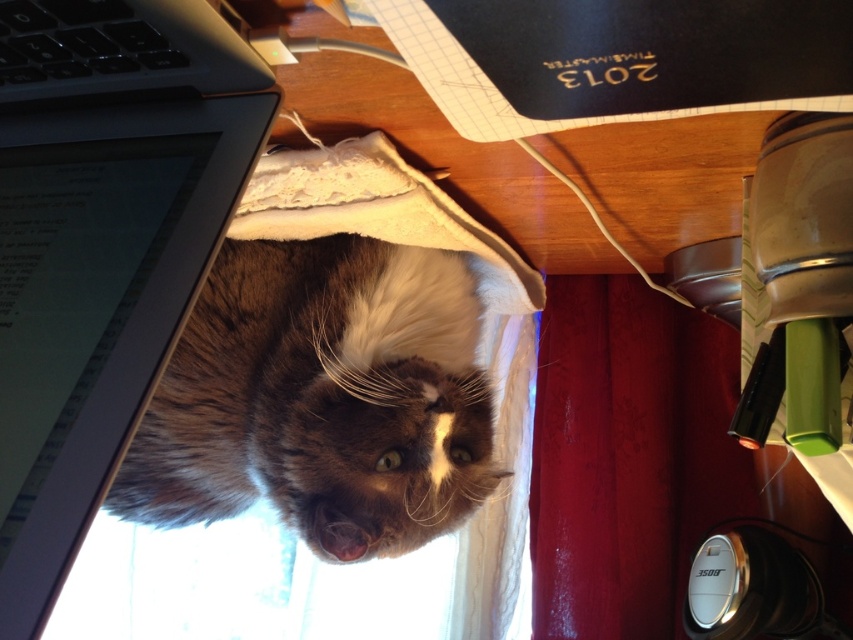
Is brown fluffy cat at center above red velvet curtain at lower right?

Yes, brown fluffy cat at center is above red velvet curtain at lower right.

Does brown fluffy cat at center have a larger size compared to red velvet curtain at lower right?

Yes, brown fluffy cat at center is bigger than red velvet curtain at lower right.

The height and width of the screenshot is (640, 853). Describe the element at coordinates (320, 397) in the screenshot. I see `brown fluffy cat at center` at that location.

Image resolution: width=853 pixels, height=640 pixels. I want to click on brown fluffy cat at center, so click(x=320, y=397).

Can you confirm if brown fluffy cat at center is shorter than black plastic keyboard at upper left?

No.

Does point (329, 529) come closer to viewer compared to point (198, 52)?

No, (329, 529) is further to viewer.

This screenshot has height=640, width=853. Find the location of `brown fluffy cat at center`. brown fluffy cat at center is located at coordinates (320, 397).

Is the position of black plastic laptop at left less distant than that of red velvet curtain at lower right?

Yes, black plastic laptop at left is closer to the viewer.

Is point (163, 241) behind point (653, 554)?

No.

This screenshot has height=640, width=853. Find the location of `black plastic laptop at left`. black plastic laptop at left is located at coordinates (102, 244).